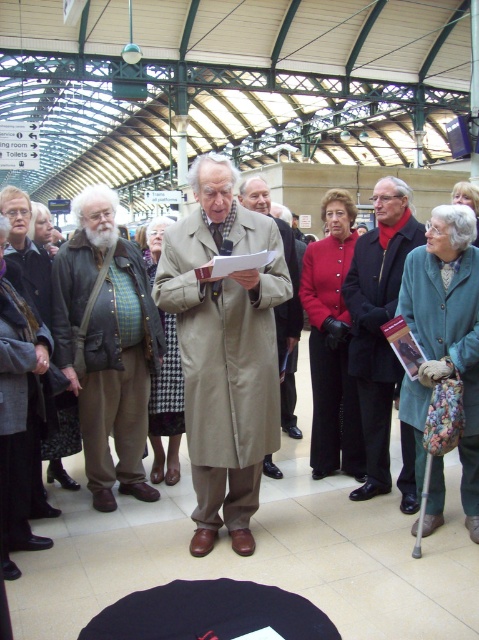
What do you see at coordinates (106, 344) in the screenshot?
I see `brown leather jacket at left` at bounding box center [106, 344].

Does brown leather jacket at left have a lesser width compared to beige fabric coat at center?

No, brown leather jacket at left is not thinner than beige fabric coat at center.

Does point (90, 289) come in front of point (286, 358)?

Yes, it is in front of point (286, 358).

Find the location of a particular element. The image size is (479, 640). brown leather jacket at left is located at coordinates (106, 344).

Between point (211, 480) and point (423, 234), which one is positioned behind?

The point (423, 234) is more distant.

Is tan fabric coat at center positioned behind dark blue coat at center?

No, tan fabric coat at center is in front of dark blue coat at center.

Which is behind, point (205, 513) or point (379, 474)?

The point (379, 474) is behind.

You are a GUI agent. You are given a task and a screenshot of the screen. Output one action in this format:
    pyautogui.click(x=<x>, y=<y>)
    Task: Click on the tan fabric coat at center
    
    Given the screenshot: What is the action you would take?
    pyautogui.click(x=225, y=349)

Looking at this image, who is lower down, dark blue coat at center or beige fabric coat at center?

Positioned lower is dark blue coat at center.

Does point (385, 193) come closer to viewer compared to point (287, 310)?

Yes.

Who is more forward, (355, 369) or (292, 259)?

Point (355, 369)

The width and height of the screenshot is (479, 640). In order to click on dark blue coat at center in this screenshot , I will do `click(377, 323)`.